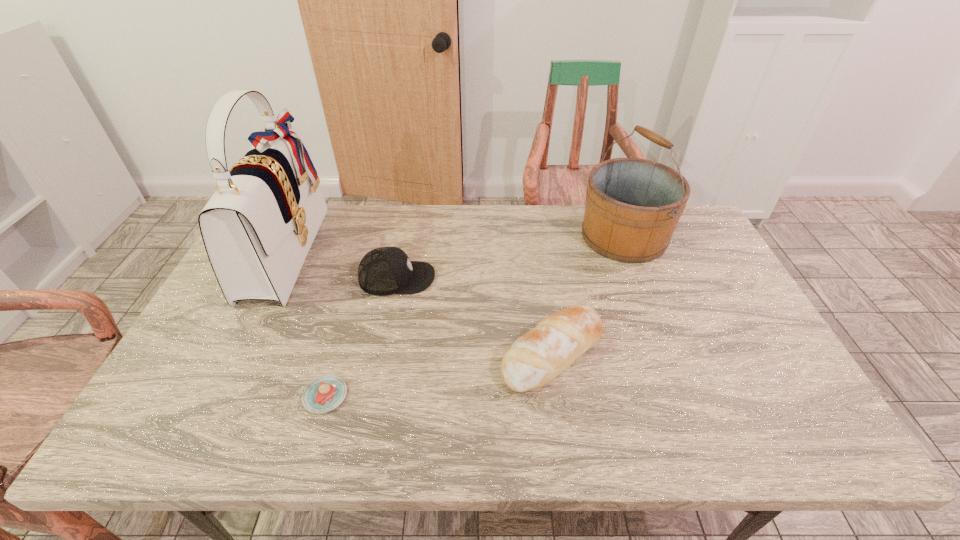
Image resolution: width=960 pixels, height=540 pixels. Find the location of `vacant space that is in between the bucket and the cap`. vacant space that is in between the bucket and the cap is located at coordinates (511, 257).

The width and height of the screenshot is (960, 540). Identify the location of unoccupied position between the cap and the pastry. (361, 337).

The image size is (960, 540). In order to click on empty space that is in between the fourth shortest object and the shortest object in this screenshot , I will do `click(474, 316)`.

Where is `the closest object to the cap`? Image resolution: width=960 pixels, height=540 pixels. the closest object to the cap is located at coordinates (257, 228).

Identify the location of object that ranks as the third closest to the second object from right to left. The height and width of the screenshot is (540, 960). (325, 393).

Find the location of a particular element. This screenshot has width=960, height=540. vacant space that satisfies the following two spatial constraints: 1. on the front-facing side of the tallest object; 2. on the left side of the shortest object is located at coordinates (214, 396).

Locate an element on the screen. vacant area that satisfies the following two spatial constraints: 1. on the front-facing side of the second object from right to left; 2. on the left side of the cap is located at coordinates (x=382, y=353).

Where is `vacant space that satisfies the following two spatial constraints: 1. on the front-facing side of the second object from right to left; 2. on the right side of the leftmost object`? Image resolution: width=960 pixels, height=540 pixels. vacant space that satisfies the following two spatial constraints: 1. on the front-facing side of the second object from right to left; 2. on the right side of the leftmost object is located at coordinates (235, 353).

I want to click on free space that satisfies the following two spatial constraints: 1. on the front-facing side of the leftmost object; 2. on the back side of the fourth object from left to right, so click(235, 353).

Find the location of `free space that satisfies the following two spatial constraints: 1. on the front-facing side of the bread; 2. on the left side of the tallest object`. free space that satisfies the following two spatial constraints: 1. on the front-facing side of the bread; 2. on the left side of the tallest object is located at coordinates (235, 353).